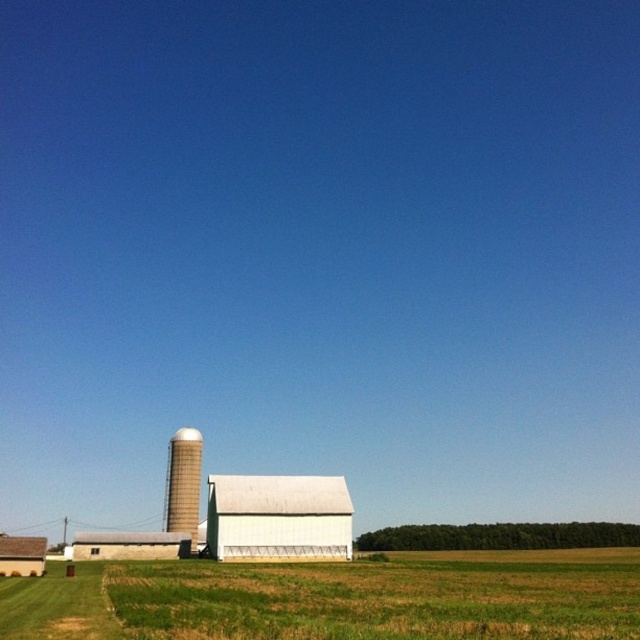
Question: Does white matte barn at center appear on the left side of white matte silo at center-left?

Choices:
 (A) no
 (B) yes

Answer: (A)

Question: Does white matte barn at center have a lesser width compared to white matte barn at lower center?

Choices:
 (A) yes
 (B) no

Answer: (A)

Question: Which object appears closest to the camera in this image?

Choices:
 (A) white matte barn at lower center
 (B) white matte barn at lower left
 (C) green grass at lower center
 (D) white matte silo at center-left

Answer: (C)

Question: Which of the following is the closest to the observer?

Choices:
 (A) white matte barn at center
 (B) white matte barn at lower center
 (C) white matte barn at lower left

Answer: (C)

Question: Which point is closer to the camera?

Choices:
 (A) white matte barn at lower left
 (B) white matte barn at lower center
 (C) white matte silo at center-left
 (D) white matte barn at center

Answer: (A)

Question: Considering the relative positions of green grass at lower center and white matte barn at lower center in the image provided, where is green grass at lower center located with respect to white matte barn at lower center?

Choices:
 (A) below
 (B) above

Answer: (B)